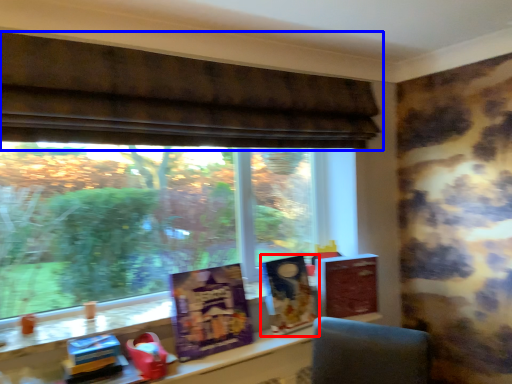
Question: Which object is further to the camera taking this photo, book cover (highlighted by a red box) or window (highlighted by a blue box)?

Choices:
 (A) book cover
 (B) window

Answer: (A)